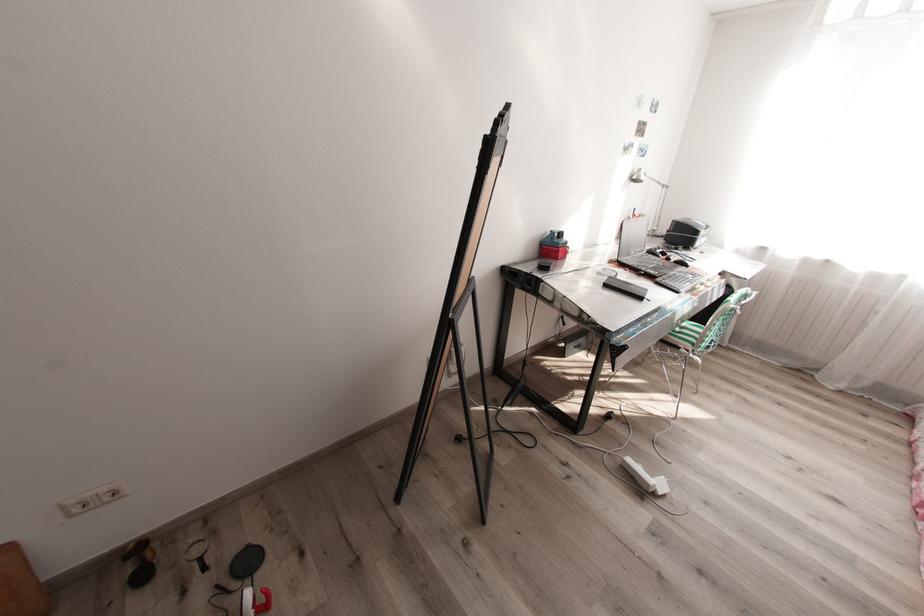
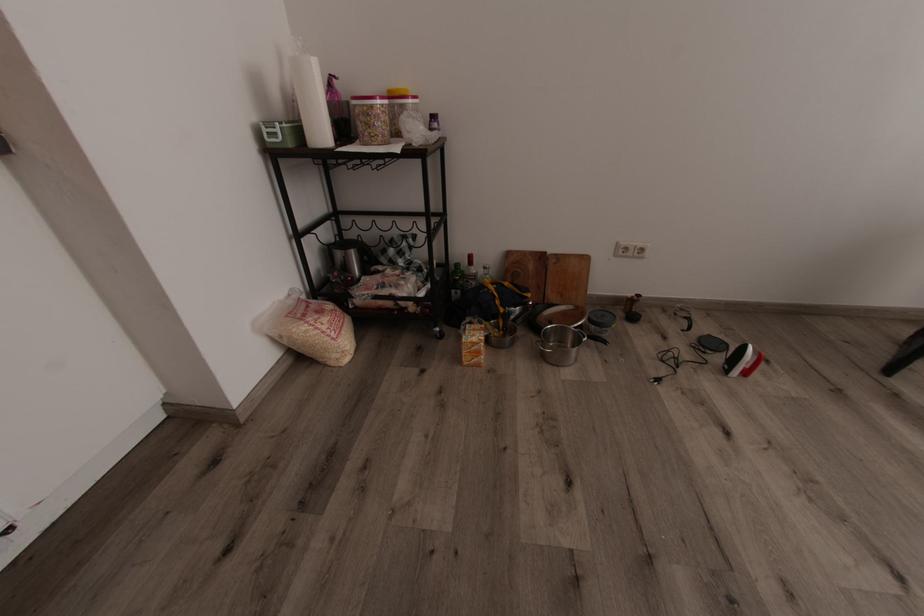
Locate, in the second image, the point that corresponds to pixel 148 576 in the first image.

(638, 317)